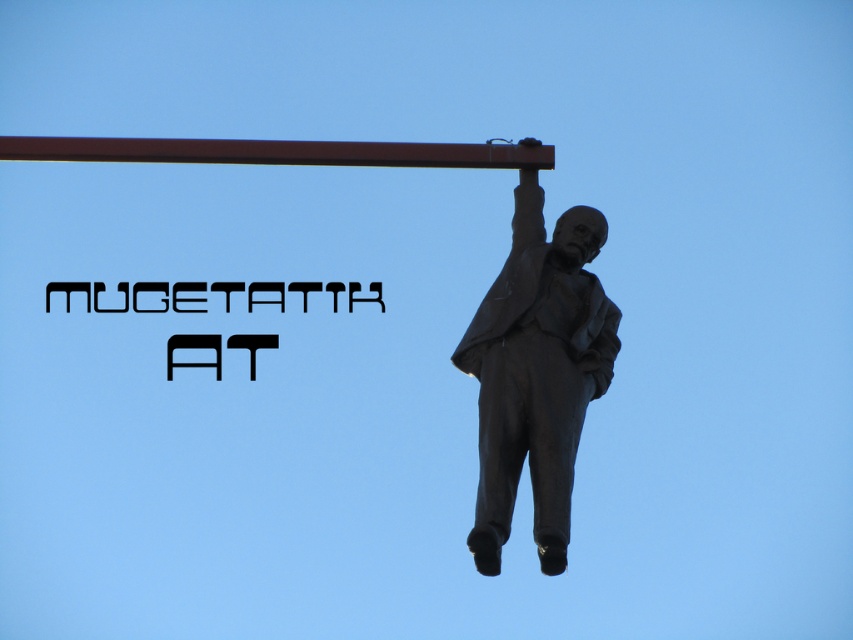
Question: Which object is farther from the camera taking this photo?

Choices:
 (A) brown metal pole at upper center
 (B) bronze statue at upper right

Answer: (A)

Question: Which point is closer to the camera?

Choices:
 (A) brown metal pole at upper center
 (B) bronze statue at upper right

Answer: (B)

Question: Where is bronze statue at upper right located in relation to brown metal pole at upper center in the image?

Choices:
 (A) above
 (B) below

Answer: (B)

Question: Which point is farther to the camera?

Choices:
 (A) brown metal pole at upper center
 (B) bronze statue at upper right

Answer: (A)

Question: Is bronze statue at upper right bigger than brown metal pole at upper center?

Choices:
 (A) no
 (B) yes

Answer: (B)

Question: Considering the relative positions of bronze statue at upper right and brown metal pole at upper center in the image provided, where is bronze statue at upper right located with respect to brown metal pole at upper center?

Choices:
 (A) above
 (B) below

Answer: (B)